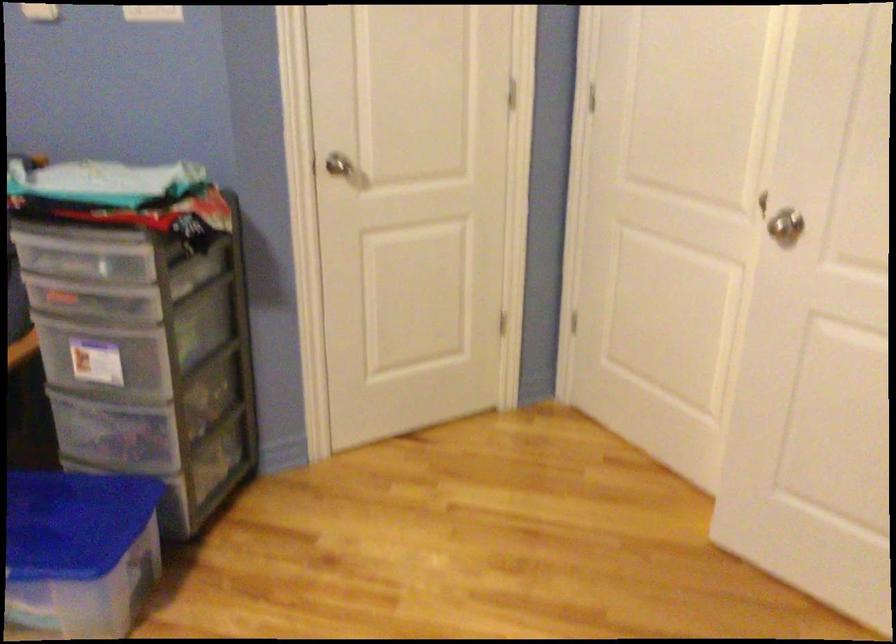
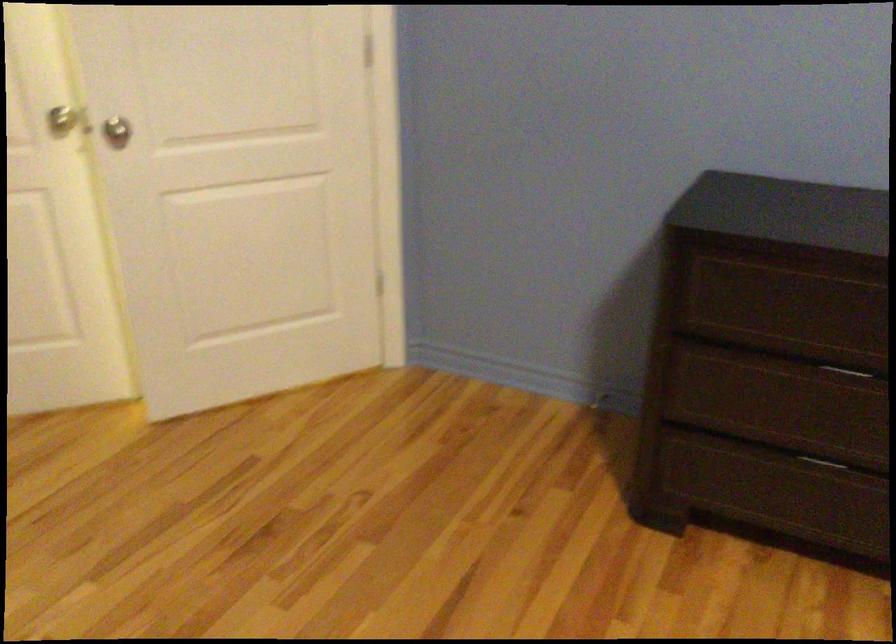
Where in the second image is the point corresponding to (800,193) from the first image?

(62, 118)